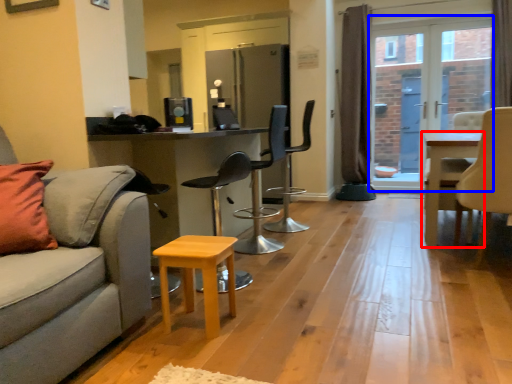
Question: Which object is further to the camera taking this photo, table (highlighted by a red box) or window screen (highlighted by a blue box)?

Choices:
 (A) table
 (B) window screen

Answer: (B)